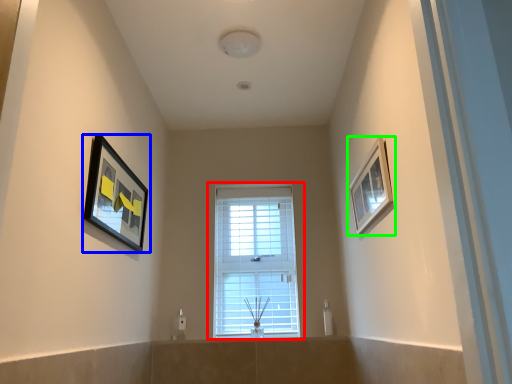
Question: Which is nearer to the window (highlighted by a red box)? picture frame (highlighted by a blue box) or picture frame (highlighted by a green box).

Choices:
 (A) picture frame
 (B) picture frame

Answer: (B)